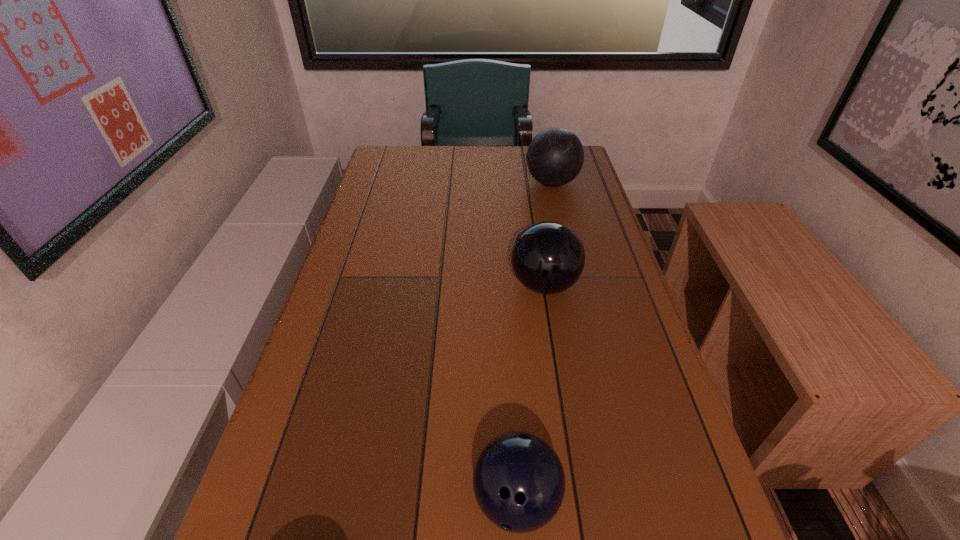
The height and width of the screenshot is (540, 960). In order to click on the farthest bowling ball in this screenshot , I will do `click(555, 156)`.

Locate an element on the screen. the second farthest bowling ball is located at coordinates 548,257.

At what (x,y) coordinates should I click in order to perform the action: click on free region located on the grip area of the farthest object. Please return your answer as a coordinate pair (x, y). The image size is (960, 540). Looking at the image, I should click on (476, 183).

This screenshot has width=960, height=540. I want to click on blank space located 0.300m on the grip area of the farthest object, so click(435, 183).

Where is `vacant space located 0.360m on the grip area of the farthest object`? vacant space located 0.360m on the grip area of the farthest object is located at coordinates (417, 183).

You are a GUI agent. You are given a task and a screenshot of the screen. Output one action in this format:
    pyautogui.click(x=<x>, y=<y>)
    Task: Click on the vacant space located on the side of the second nearest bowling ball with the finger holes
    
    Given the screenshot: What is the action you would take?
    pyautogui.click(x=362, y=285)

Identify the location of vacant area situated 0.310m on the side of the second nearest bowling ball with the finger holes. (386, 285).

Where is `free space located 0.390m on the side of the second nearest bowling ball with the finger holes`? This screenshot has width=960, height=540. free space located 0.390m on the side of the second nearest bowling ball with the finger holes is located at coordinates (353, 285).

Find the location of `object positioned at the far edge`. object positioned at the far edge is located at coordinates (555, 156).

Identify the location of object at the far right corner. [x=555, y=156].